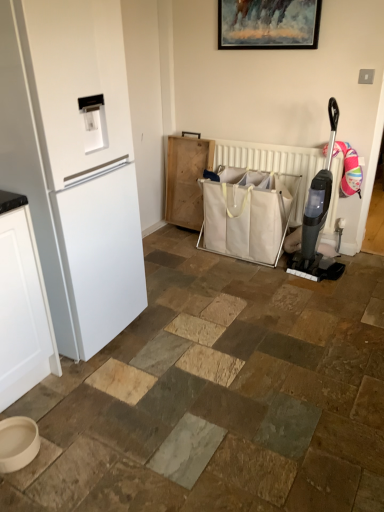
Question: Is white matte refrigerator at left wider than wooden picture frame at upper center?

Choices:
 (A) no
 (B) yes

Answer: (B)

Question: From a real-world perspective, is white matte refrigerator at left located beneath wooden picture frame at upper center?

Choices:
 (A) yes
 (B) no

Answer: (A)

Question: Is white matte refrigerator at left to the left of wooden picture frame at upper center from the viewer's perspective?

Choices:
 (A) no
 (B) yes

Answer: (B)

Question: Is white matte refrigerator at left not close to wooden picture frame at upper center?

Choices:
 (A) no
 (B) yes

Answer: (B)

Question: From the image's perspective, does white matte refrigerator at left appear higher than wooden picture frame at upper center?

Choices:
 (A) no
 (B) yes

Answer: (A)

Question: Is white matte refrigerator at left thinner than wooden picture frame at upper center?

Choices:
 (A) yes
 (B) no

Answer: (B)

Question: Does white canvas shopping bag at center have a lesser height compared to black plastic vacuum cleaner at right?

Choices:
 (A) no
 (B) yes

Answer: (B)

Question: Is white canvas shopping bag at center outside of black plastic vacuum cleaner at right?

Choices:
 (A) yes
 (B) no

Answer: (A)

Question: Considering the relative sizes of white canvas shopping bag at center and black plastic vacuum cleaner at right in the image provided, is white canvas shopping bag at center wider than black plastic vacuum cleaner at right?

Choices:
 (A) yes
 (B) no

Answer: (A)

Question: Considering the relative positions of white canvas shopping bag at center and black plastic vacuum cleaner at right in the image provided, is white canvas shopping bag at center in front of black plastic vacuum cleaner at right?

Choices:
 (A) no
 (B) yes

Answer: (A)

Question: From the image's perspective, does white canvas shopping bag at center appear higher than black plastic vacuum cleaner at right?

Choices:
 (A) no
 (B) yes

Answer: (A)

Question: Is black plastic vacuum cleaner at right surrounded by white canvas shopping bag at center?

Choices:
 (A) no
 (B) yes

Answer: (A)

Question: Can you confirm if black plastic vacuum cleaner at right is shorter than white matte refrigerator at left?

Choices:
 (A) no
 (B) yes

Answer: (B)